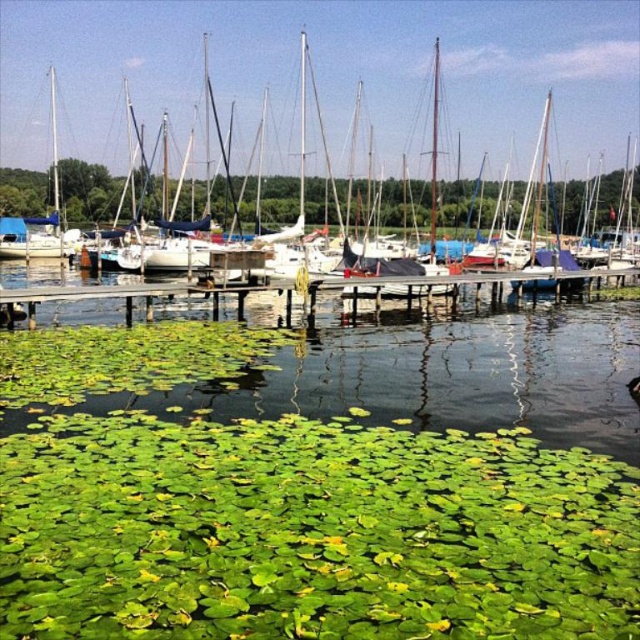
Does white matte sailboat at center have a greater height compared to wooden dock at center?

Yes.

Is point (614, 52) positioned in front of point (237, 312)?

No.

Who is more forward, (326, 172) or (408, 294)?

Point (408, 294) is more forward.

Identify the location of white matte sailboat at center. The width and height of the screenshot is (640, 640). (305, 148).